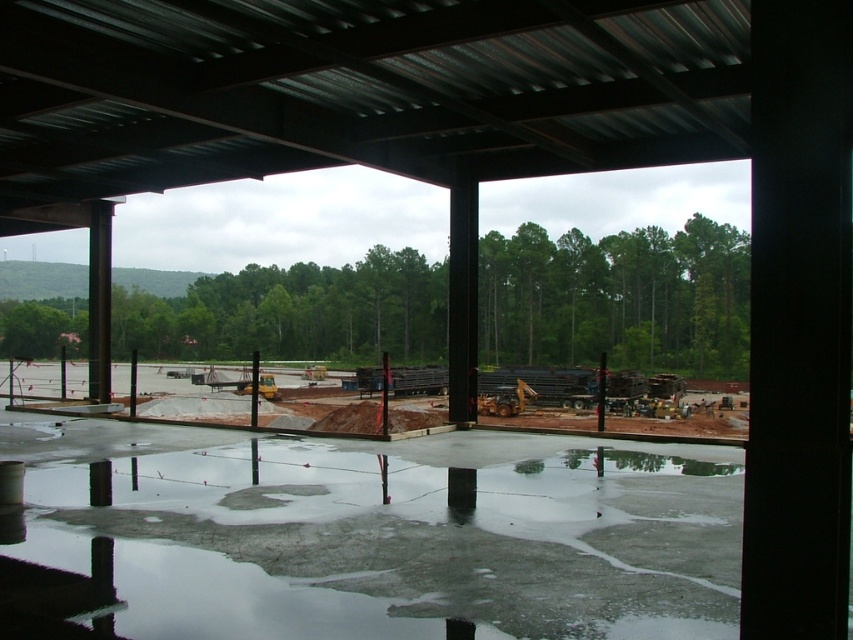
From the picture: You are a construction worker standing at the entrance of the partially completed building. You need to place a heavy beam between the two points marked as point (613, 465) and point (103, 250). Which point should the beam be closer to in order to ensure stability?

The beam should be placed closer to point (613, 465) because it is closer to the camera, making it a more stable position for the beam.

You are a construction worker who needs to place a 2.5 meter long metal beam horizontally between the glossy concrete flood at lower center and the metallic pole at left. Can you do this without the beam touching the ground?

The glossy concrete flood at lower center is not as tall as metallic pole at left, so the height difference between them allows placing the 2.5 meter long metal beam horizontally between them without touching the ground.

You are a safety inspector standing at the entrance of the partially completed building. You need to check the stability of the metallic pole at left and the glossy concrete flood at lower center. Based on their positions, which object is closer to the ground?

The glossy concrete flood at lower center is located below the metallic pole at left, so it is closer to the ground than the metallic pole at left.